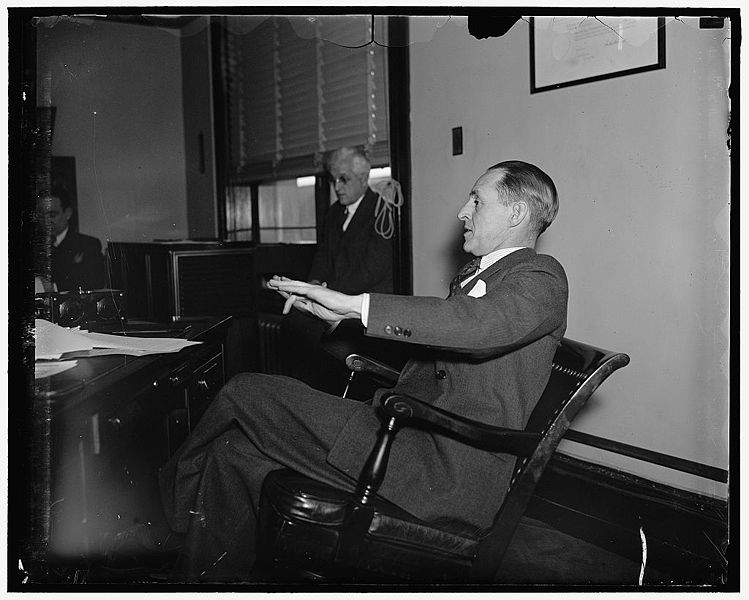
Find the location of `chair leaning back`. chair leaning back is located at coordinates (342, 514).